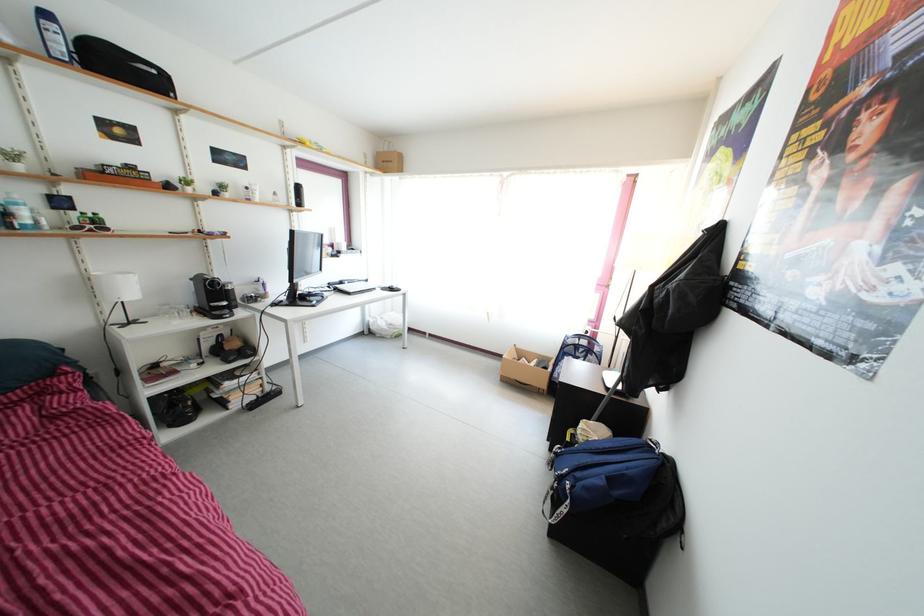
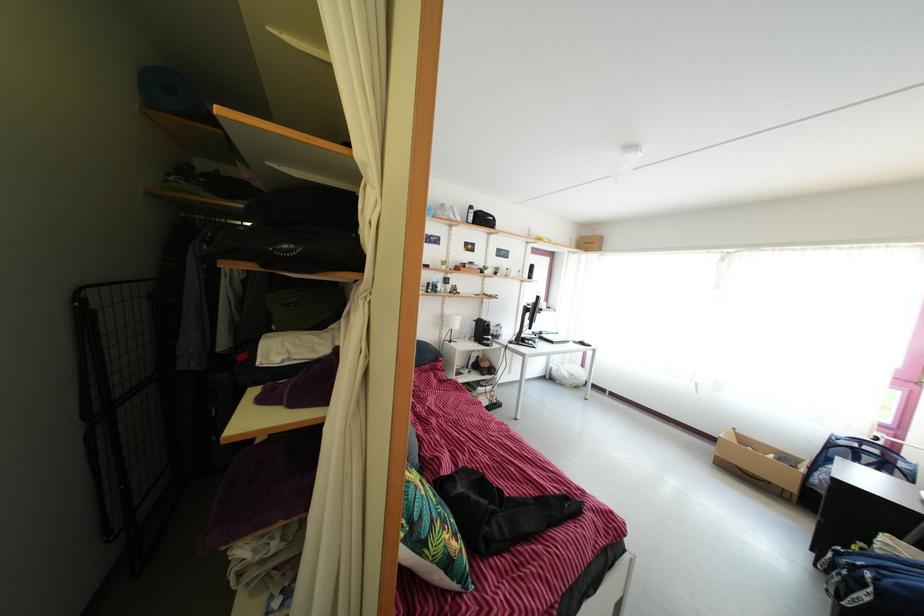
In the second image, find the point that corresponds to point (563, 383) in the first image.

(821, 488)